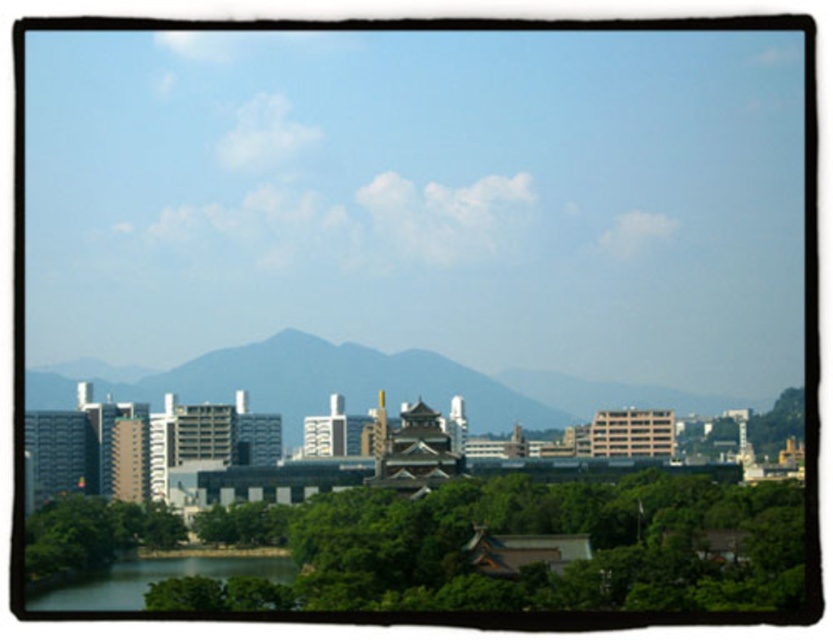
You are a city planner analyzing the urban layout. Given the green leafy trees at lower center and the green smooth water at lower left, which one occupies a larger horizontal space in the scene?

The green leafy trees at lower center occupy a larger horizontal space because their width surpasses that of the green smooth water at lower left.